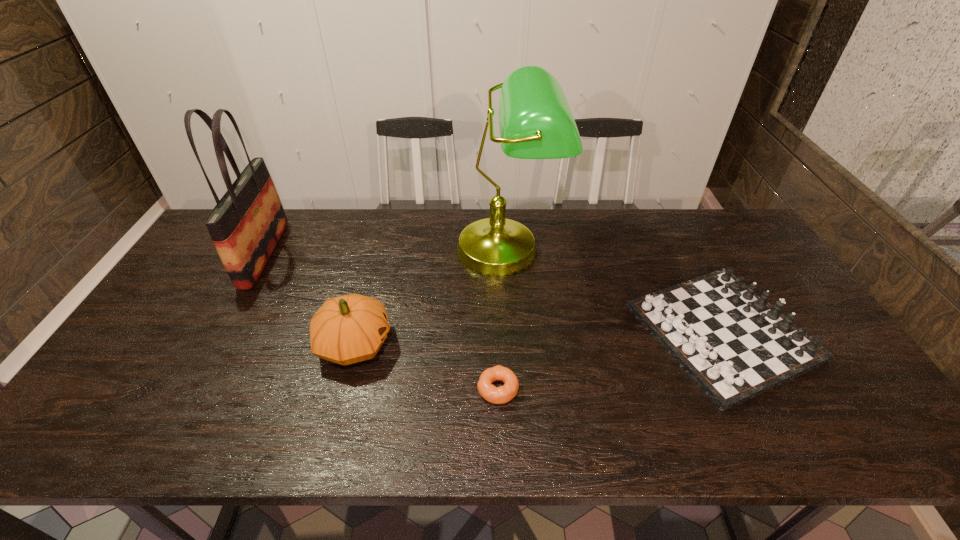
Locate an element on the screen. blank space located 0.220m on the back of the rightmost object is located at coordinates [669, 231].

You are a GUI agent. You are given a task and a screenshot of the screen. Output one action in this format:
    pyautogui.click(x=<x>, y=<y>)
    Task: Click on the free point located 0.210m on the right of the doughnut
    The height and width of the screenshot is (540, 960).
    Given the screenshot: What is the action you would take?
    pyautogui.click(x=605, y=389)

This screenshot has width=960, height=540. Find the location of `lamp at the far edge`. lamp at the far edge is located at coordinates (535, 120).

The height and width of the screenshot is (540, 960). In order to click on shopping bag present at the far edge in this screenshot , I will do `click(247, 223)`.

The height and width of the screenshot is (540, 960). Find the location of `object located in the near edge section of the desktop`. object located in the near edge section of the desktop is located at coordinates (734, 345).

Identify the location of object at the right edge. coord(734,345).

Where is `object that is at the near right corner`? object that is at the near right corner is located at coordinates (734, 345).

In the image, there is a desktop. What are the coordinates of `blank space at the far edge` in the screenshot? It's located at (627, 251).

This screenshot has width=960, height=540. What are the coordinates of `free spot at the near edge of the desktop` in the screenshot? It's located at (553, 431).

The image size is (960, 540). What are the coordinates of `vacant space at the left edge of the desktop` in the screenshot? It's located at (114, 408).